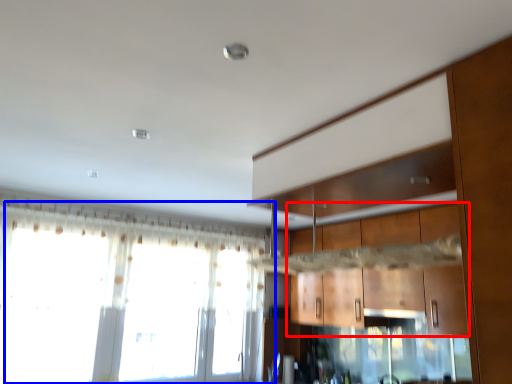
Question: Which object appears closest to the camera in this image, cabinetry (highlighted by a red box) or window (highlighted by a blue box)?

Choices:
 (A) cabinetry
 (B) window

Answer: (A)